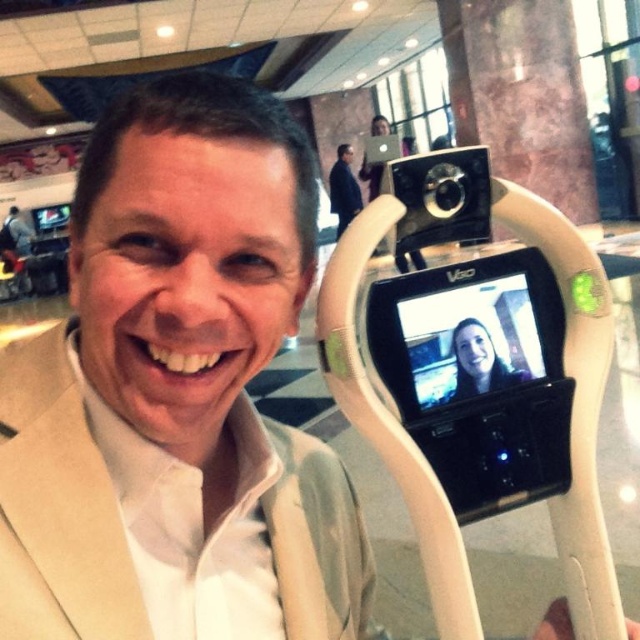
You are a photographer trying to capture a candid shot of the man and the robot in the scene. The black plastic camera at upper center is mounted on a tripod. To ensure the camera captures both subjects clearly, where should you position the camera relative to the man and the robot?

The black plastic camera at upper center is already positioned at point [440,196], so you should keep it there to capture both the man on the left and the robot on the right clearly.

You are a photographer at a busy event and need to take a photo of the man and the robot. The black plastic camera at upper center and the black matte suit at upper center are both in your view. Which object is positioned lower in the frame?

The black plastic camera at upper center is positioned below the black matte suit at upper center, so it is lower in the frame.

Based on the photo, you are a photographer standing in the scene and want to take a photo of the black plastic camera at upper center and the black matte suit at upper center. Can you fit both objects in your camera frame if your camera has a maximum distance of 6 meters between objects?

The black plastic camera at upper center is 6.65 meters from the black matte suit at upper center. Since the distance exceeds the camera frame limit of 6 meters, you cannot fit both objects in the frame.